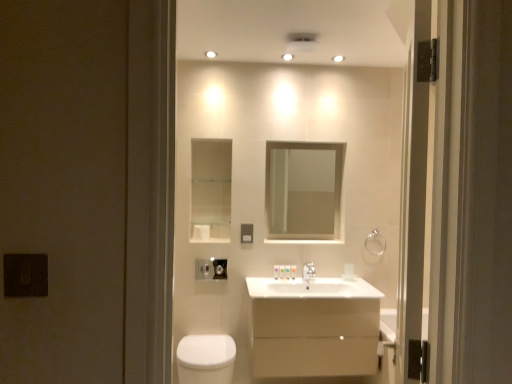
Question: Considering the relative sizes of satin nickel faucet at center and white glossy sink at center in the image provided, is satin nickel faucet at center wider than white glossy sink at center?

Choices:
 (A) no
 (B) yes

Answer: (A)

Question: From the image's perspective, would you say satin nickel faucet at center is positioned over white glossy sink at center?

Choices:
 (A) yes
 (B) no

Answer: (A)

Question: Is satin nickel faucet at center further to camera compared to white glossy sink at center?

Choices:
 (A) yes
 (B) no

Answer: (A)

Question: Is satin nickel faucet at center positioned with its back to white glossy sink at center?

Choices:
 (A) no
 (B) yes

Answer: (A)

Question: Does satin nickel faucet at center have a lesser height compared to white glossy sink at center?

Choices:
 (A) no
 (B) yes

Answer: (B)

Question: Is satin nickel faucet at center in contact with white glossy sink at center?

Choices:
 (A) yes
 (B) no

Answer: (B)

Question: Is translucent plastic tube at center, placed as the 1th toiletry when sorted from left to right, facing towards satin nickel faucet at center?

Choices:
 (A) yes
 (B) no

Answer: (B)

Question: Is translucent plastic tube at center, acting as the second toiletry starting from the right, looking in the opposite direction of satin nickel faucet at center?

Choices:
 (A) yes
 (B) no

Answer: (B)

Question: Can you confirm if translucent plastic tube at center, acting as the second toiletry starting from the right, is smaller than satin nickel faucet at center?

Choices:
 (A) yes
 (B) no

Answer: (A)

Question: Considering the relative positions of translucent plastic tube at center, acting as the second toiletry starting from the right, and satin nickel faucet at center in the image provided, is translucent plastic tube at center, acting as the second toiletry starting from the right, behind satin nickel faucet at center?

Choices:
 (A) no
 (B) yes

Answer: (B)

Question: Is translucent plastic tube at center, placed as the 1th toiletry when sorted from left to right, shorter than satin nickel faucet at center?

Choices:
 (A) no
 (B) yes

Answer: (B)

Question: Considering the relative positions of translucent plastic tube at center, acting as the second toiletry starting from the right, and satin nickel faucet at center in the image provided, is translucent plastic tube at center, acting as the second toiletry starting from the right, in front of satin nickel faucet at center?

Choices:
 (A) no
 (B) yes

Answer: (A)

Question: Is white glossy toiletries at center, the second toiletry viewed from the left, facing away from satin nickel faucet at center?

Choices:
 (A) yes
 (B) no

Answer: (B)